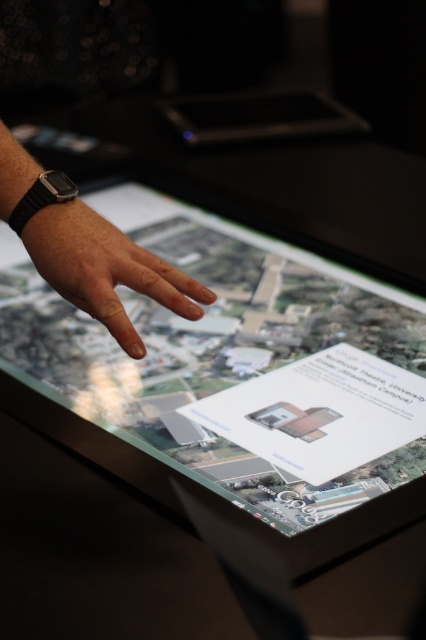
What are the coordinates of the smooth skin hand at center in the image?

The smooth skin hand at center is located at coordinates point (104, 268).

You are standing in front of a large touchscreen display showing a campus map. Your task is to reach the point indicated by the hand pointing at point (264, 368). If your arm can extend 32 inches, will you be able to reach that point without moving closer?

The point (264, 368) is 34.36 inches from the viewer. Since your arm can only extend 32 inches, you will not be able to reach it without moving closer.